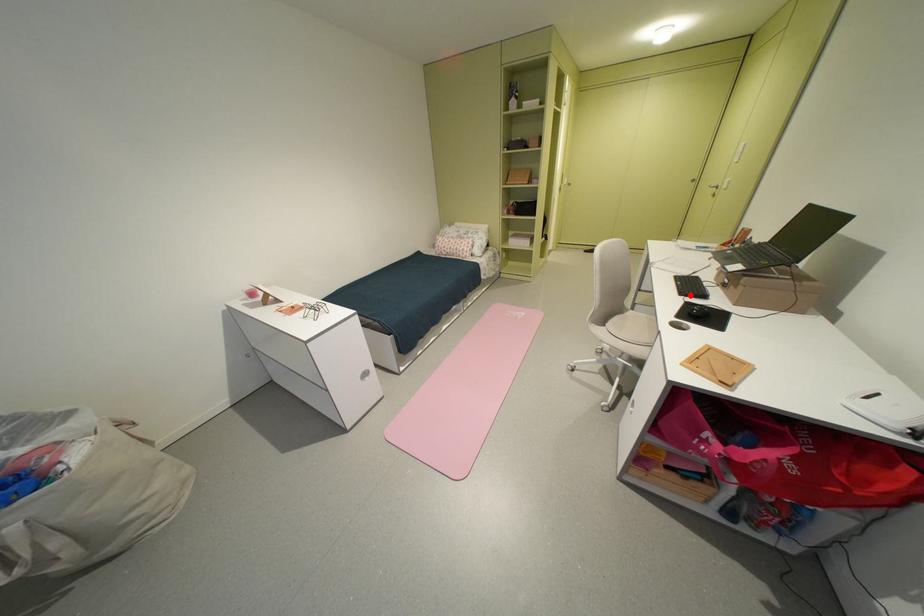
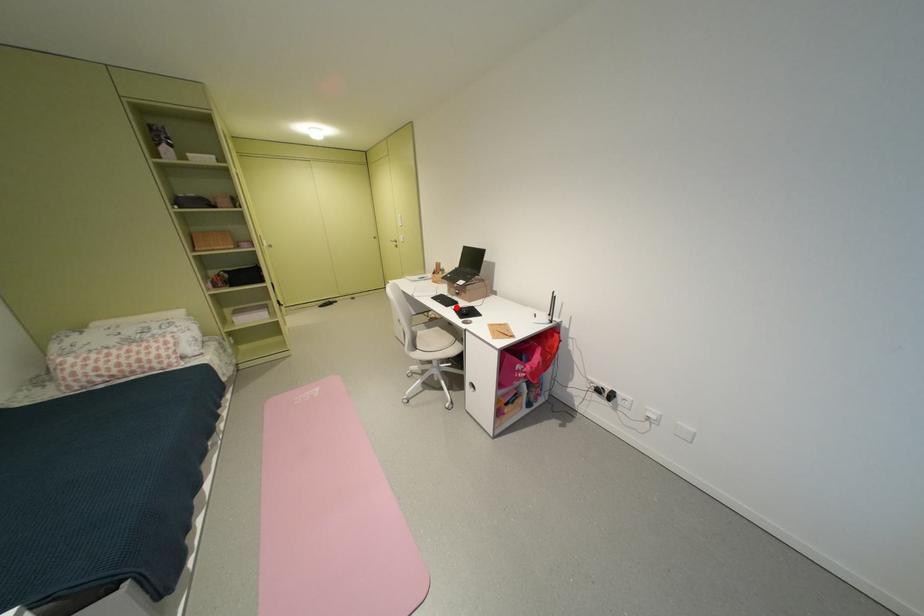
I am providing you with two images of the same scene from different viewpoints. A red point is marked on the first image and another point is marked on the second image. Does the point marked in image1 correspond to the same location as the one in image2?

Yes